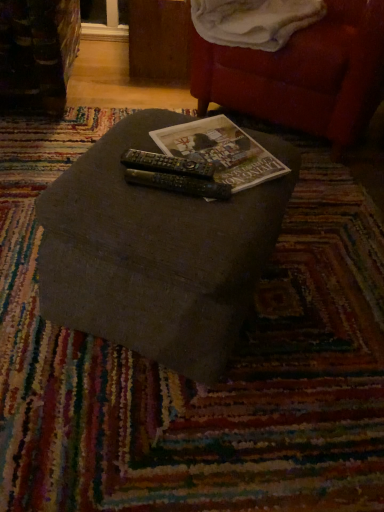
You are a GUI agent. You are given a task and a screenshot of the screen. Output one action in this format:
    pyautogui.click(x=<x>, y=<y>)
    Task: Click on the black plastic remote at center, the 1th remote in the back-to-front sequence
    This screenshot has height=512, width=384.
    Given the screenshot: What is the action you would take?
    pyautogui.click(x=166, y=164)

The image size is (384, 512). What do you see at coordinates (302, 74) in the screenshot?
I see `velvet red bean bag chair at upper right` at bounding box center [302, 74].

What do you see at coordinates (156, 253) in the screenshot?
I see `textured gray ottoman at center` at bounding box center [156, 253].

Measure the distance between point (253, 279) and camera.

34.13 inches.

This screenshot has height=512, width=384. I want to click on white soft blanket at upper right, so click(x=254, y=21).

The width and height of the screenshot is (384, 512). What do you see at coordinates (254, 21) in the screenshot?
I see `white soft blanket at upper right` at bounding box center [254, 21].

Locate an element on the screen. This screenshot has height=512, width=384. black plastic remote at center, arranged as the first remote when viewed from the front is located at coordinates (179, 184).

Is black plastic remote at center, acting as the second remote starting from the back, inside or outside of matte paper book at center?

black plastic remote at center, acting as the second remote starting from the back, is spatially situated outside matte paper book at center.

Can you confirm if black plastic remote at center, acting as the second remote starting from the back, is positioned to the left of matte paper book at center?

Yes.

Can you confirm if black plastic remote at center, arranged as the first remote when viewed from the front, is taller than matte paper book at center?

Incorrect, the height of black plastic remote at center, arranged as the first remote when viewed from the front, is not larger of that of matte paper book at center.

Is black plastic remote at center, acting as the second remote starting from the back, in front of or behind matte paper book at center in the image?

In the image, black plastic remote at center, acting as the second remote starting from the back, appears in front of matte paper book at center.

Locate an element on the screen. blanket located above the textured gray ottoman at center (from the image's perspective) is located at coordinates (254, 21).

Which object is positioned more to the right, textured gray ottoman at center or white soft blanket at upper right?

Positioned to the right is white soft blanket at upper right.

Is textured gray ottoman at center surrounding white soft blanket at upper right?

That's incorrect, white soft blanket at upper right is not inside textured gray ottoman at center.

Considering the positions of objects textured gray ottoman at center and white soft blanket at upper right in the image provided, who is behind, textured gray ottoman at center or white soft blanket at upper right?

white soft blanket at upper right is further from the camera.

Considering the points (146, 159) and (212, 73), which point is in front, point (146, 159) or point (212, 73)?

The point (146, 159) is more forward.

Which object is closer to the camera, black plastic remote at center, the 2th remote viewed from the front, or velvet red bean bag chair at upper right?

black plastic remote at center, the 2th remote viewed from the front, is closer to the camera.

Can you confirm if black plastic remote at center, the 1th remote in the back-to-front sequence, is thinner than velvet red bean bag chair at upper right?

Yes.

Is black plastic remote at center, the 2th remote viewed from the front, smaller than velvet red bean bag chair at upper right?

Yes, black plastic remote at center, the 2th remote viewed from the front, is smaller than velvet red bean bag chair at upper right.

Which is more to the right, black plastic remote at center, the 2th remote viewed from the front, or white soft blanket at upper right?

white soft blanket at upper right is more to the right.

From a real-world perspective, is black plastic remote at center, the 1th remote in the back-to-front sequence, physically located above or below white soft blanket at upper right?

From a real-world perspective, black plastic remote at center, the 1th remote in the back-to-front sequence, is physically below white soft blanket at upper right.

Can you confirm if black plastic remote at center, the 2th remote viewed from the front, is taller than white soft blanket at upper right?

No, black plastic remote at center, the 2th remote viewed from the front, is not taller than white soft blanket at upper right.

From the image's perspective, which is below, black plastic remote at center, the 2th remote viewed from the front, or white soft blanket at upper right?

black plastic remote at center, the 2th remote viewed from the front, appears lower in the image.

Is black plastic remote at center, acting as the second remote starting from the back, taller or shorter than velvet red bean bag chair at upper right?

black plastic remote at center, acting as the second remote starting from the back, is shorter than velvet red bean bag chair at upper right.

Is black plastic remote at center, arranged as the first remote when viewed from the front, far from velvet red bean bag chair at upper right?

Actually, black plastic remote at center, arranged as the first remote when viewed from the front, and velvet red bean bag chair at upper right are a little close together.

How many degrees apart are the facing directions of black plastic remote at center, arranged as the first remote when viewed from the front, and velvet red bean bag chair at upper right?

The angular difference between black plastic remote at center, arranged as the first remote when viewed from the front, and velvet red bean bag chair at upper right is 71.8 degrees.

Which object is wider, black plastic remote at center, the 1th remote in the back-to-front sequence, or black plastic remote at center, arranged as the first remote when viewed from the front?

black plastic remote at center, the 1th remote in the back-to-front sequence, is wider.

From a real-world perspective, is black plastic remote at center, the 1th remote in the back-to-front sequence, positioned above or below black plastic remote at center, acting as the second remote starting from the back?

From a real-world perspective, black plastic remote at center, the 1th remote in the back-to-front sequence, is physically above black plastic remote at center, acting as the second remote starting from the back.

This screenshot has height=512, width=384. I want to click on remote in front of the black plastic remote at center, the 2th remote viewed from the front, so click(179, 184).

Considering their positions, is black plastic remote at center, the 2th remote viewed from the front, located in front of or behind black plastic remote at center, acting as the second remote starting from the back?

black plastic remote at center, the 2th remote viewed from the front, is behind black plastic remote at center, acting as the second remote starting from the back.

Is velvet red bean bag chair at upper right at the left side of black plastic remote at center, the 1th remote in the back-to-front sequence?

Incorrect, velvet red bean bag chair at upper right is not on the left side of black plastic remote at center, the 1th remote in the back-to-front sequence.

How much distance is there between velvet red bean bag chair at upper right and black plastic remote at center, the 2th remote viewed from the front?

The distance of velvet red bean bag chair at upper right from black plastic remote at center, the 2th remote viewed from the front, is 36.47 inches.

From the image's perspective, is velvet red bean bag chair at upper right located beneath black plastic remote at center, the 1th remote in the back-to-front sequence?

Actually, velvet red bean bag chair at upper right appears above black plastic remote at center, the 1th remote in the back-to-front sequence, in the image.

Consider the image. Is velvet red bean bag chair at upper right oriented towards black plastic remote at center, the 2th remote viewed from the front?

Yes, velvet red bean bag chair at upper right is oriented towards black plastic remote at center, the 2th remote viewed from the front.

You are a GUI agent. You are given a task and a screenshot of the screen. Output one action in this format:
    pyautogui.click(x=<x>, y=<y>)
    Task: Click on the paperback book behind the black plastic remote at center, arranged as the first remote when viewed from the front
    
    Given the screenshot: What is the action you would take?
    pyautogui.click(x=221, y=151)

At what (x,y) coordinates should I click in order to perform the action: click on table in front of the white soft blanket at upper right. Please return your answer as a coordinate pair (x, y). Looking at the image, I should click on (156, 253).

Considering their positions, is black plastic remote at center, arranged as the first remote when viewed from the front, positioned closer to white soft blanket at upper right than matte paper book at center?

Among the two, matte paper book at center is located nearer to white soft blanket at upper right.

Estimate the real-world distances between objects in this image. Which object is closer to black plastic remote at center, the 1th remote in the back-to-front sequence, textured gray ottoman at center or velvet red bean bag chair at upper right?

textured gray ottoman at center is positioned closer to the anchor black plastic remote at center, the 1th remote in the back-to-front sequence.

From the image, which object appears to be farther from black plastic remote at center, the 2th remote viewed from the front, velvet red bean bag chair at upper right or white soft blanket at upper right?

Based on the image, velvet red bean bag chair at upper right appears to be further to black plastic remote at center, the 2th remote viewed from the front.

When comparing their distances from velvet red bean bag chair at upper right, does matte paper book at center or white soft blanket at upper right seem closer?

white soft blanket at upper right.

Looking at the image, which one is located further to white soft blanket at upper right, textured gray ottoman at center or black plastic remote at center, the 1th remote in the back-to-front sequence?

textured gray ottoman at center.

Estimate the real-world distances between objects in this image. Which object is further from black plastic remote at center, the 1th remote in the back-to-front sequence, matte paper book at center or velvet red bean bag chair at upper right?

velvet red bean bag chair at upper right lies further to black plastic remote at center, the 1th remote in the back-to-front sequence, than the other object.

Consider the image. Looking at the image, which one is located closer to velvet red bean bag chair at upper right, black plastic remote at center, the 2th remote viewed from the front, or black plastic remote at center, acting as the second remote starting from the back?

Based on the image, black plastic remote at center, the 2th remote viewed from the front, appears to be nearer to velvet red bean bag chair at upper right.

Consider the image. Based on their spatial positions, is black plastic remote at center, the 2th remote viewed from the front, or textured gray ottoman at center closer to white soft blanket at upper right?

The object closer to white soft blanket at upper right is black plastic remote at center, the 2th remote viewed from the front.

The width and height of the screenshot is (384, 512). What are the coordinates of `remote positioned between textured gray ottoman at center and matte paper book at center from near to far` in the screenshot? It's located at (179, 184).

I want to click on paperback book between velvet red bean bag chair at upper right and textured gray ottoman at center in the vertical direction, so click(x=221, y=151).

Find the location of a particular element. Image resolution: width=384 pixels, height=512 pixels. remote situated between black plastic remote at center, the 2th remote viewed from the front, and matte paper book at center from left to right is located at coordinates (179, 184).

The image size is (384, 512). What are the coordinates of `paperback book between white soft blanket at upper right and textured gray ottoman at center from top to bottom` in the screenshot? It's located at (221, 151).